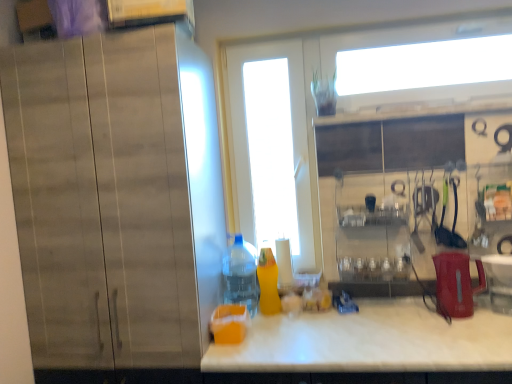
Find the location of a particular element. vacant space to the right of yellow glass bottle at center, which is the 2th bottle in left-to-right order is located at coordinates (306, 317).